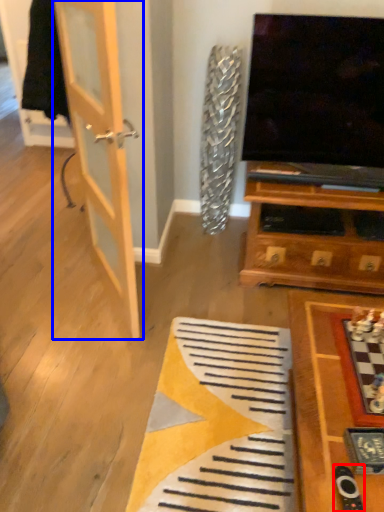
Question: Which of the following is the farthest to the observer, remote (highlighted by a red box) or door (highlighted by a blue box)?

Choices:
 (A) remote
 (B) door

Answer: (B)